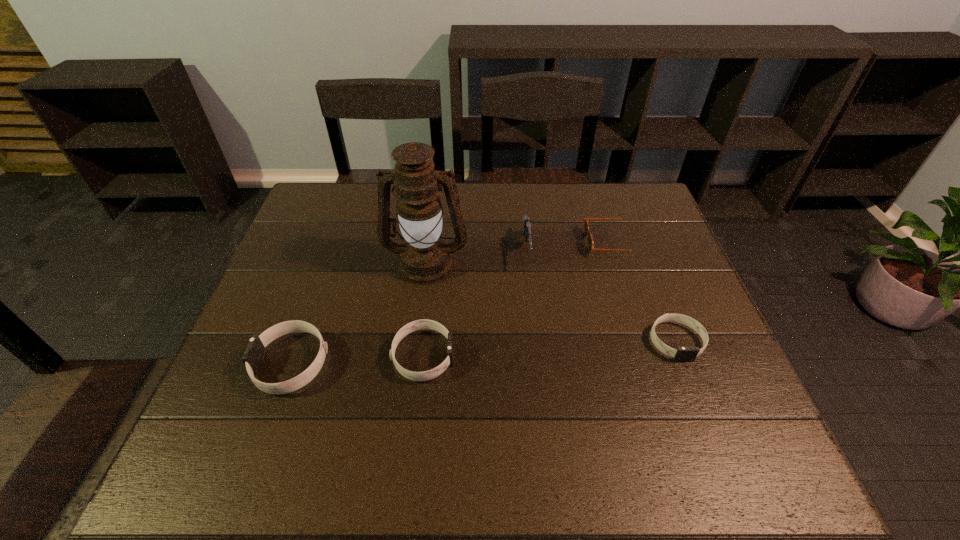
Identify the location of vacant area situated on the front-facing side of the sunglasses. The image size is (960, 540). (541, 242).

Where is `vacant point located 0.290m on the front-facing side of the sunglasses`? The width and height of the screenshot is (960, 540). vacant point located 0.290m on the front-facing side of the sunglasses is located at coordinates (488, 242).

Identify the location of vacant space located 0.340m on the right of the oil lamp. (589, 263).

At what (x,y) coordinates should I click in order to perform the action: click on free location located at the barrel of the gun. Please return your answer as a coordinate pair (x, y). The image size is (960, 540). Looking at the image, I should click on (540, 367).

Where is `object at the near edge`? The width and height of the screenshot is (960, 540). object at the near edge is located at coordinates (255, 351).

The height and width of the screenshot is (540, 960). Find the location of `object located at the left edge`. object located at the left edge is located at coordinates (255, 351).

At what (x,y) coordinates should I click in order to perform the action: click on wristband present at the right edge. Please return your answer as a coordinate pair (x, y). The width and height of the screenshot is (960, 540). Looking at the image, I should click on (682, 354).

Find the location of a particular element. This screenshot has width=960, height=540. sunglasses present at the right edge is located at coordinates (591, 248).

The width and height of the screenshot is (960, 540). Identify the location of object present at the near left corner. (255, 351).

In the image, there is a desktop. Where is `blank space at the far edge`? blank space at the far edge is located at coordinates (392, 224).